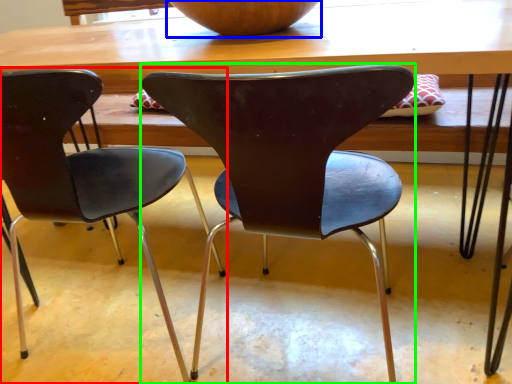
Question: Which is nearer to the chair (highlighted by a red box)? bowl (highlighted by a blue box) or chair (highlighted by a green box).

Choices:
 (A) bowl
 (B) chair

Answer: (B)